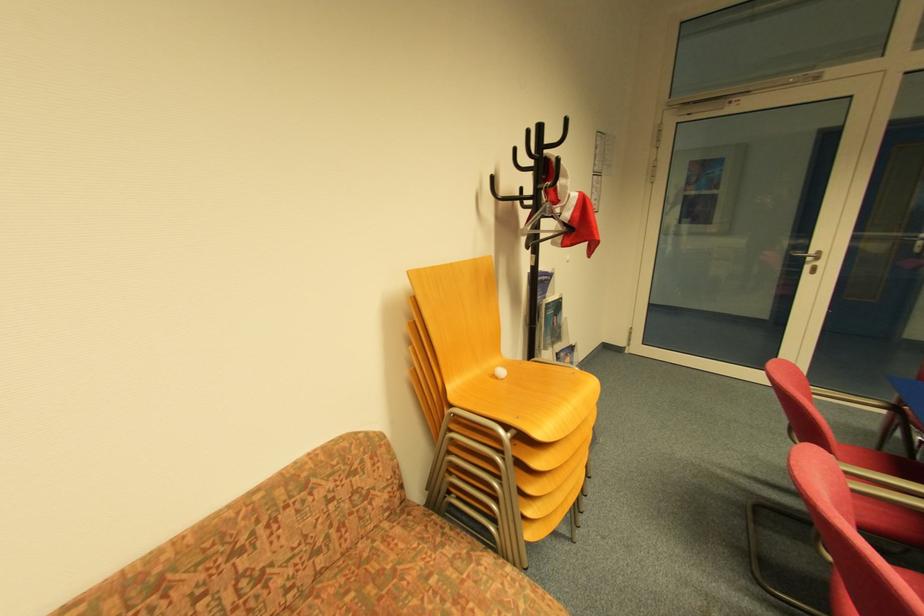
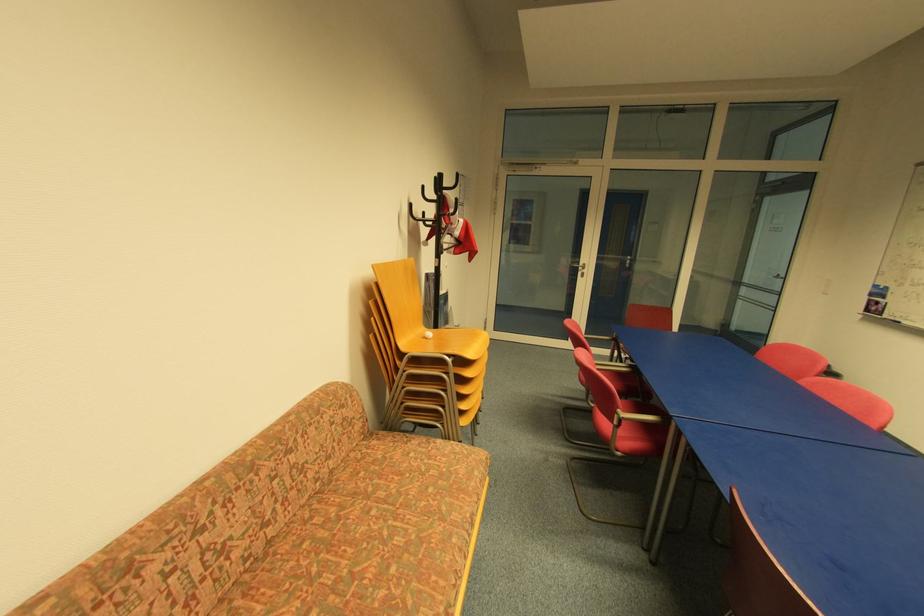
Locate, in the second image, the point that corresponds to point (563, 347) in the first image.

(452, 329)